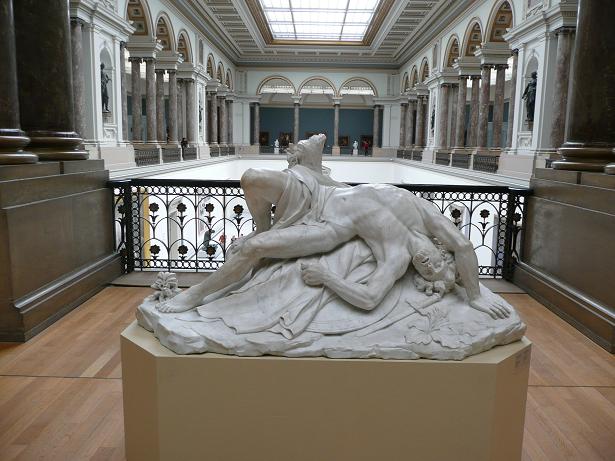
Locate an element on the screen. statue is located at coordinates (355, 213).